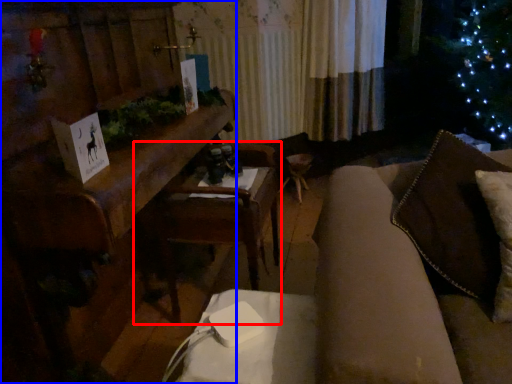
Question: Which point is closer to the camera, armchair (highlighted by a red box) or furniture (highlighted by a blue box)?

Choices:
 (A) armchair
 (B) furniture

Answer: (B)